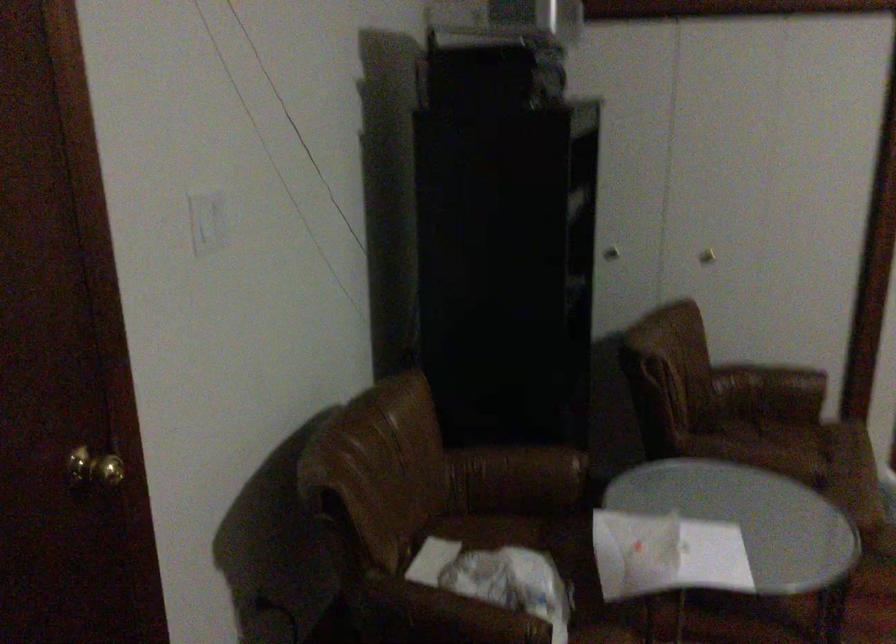
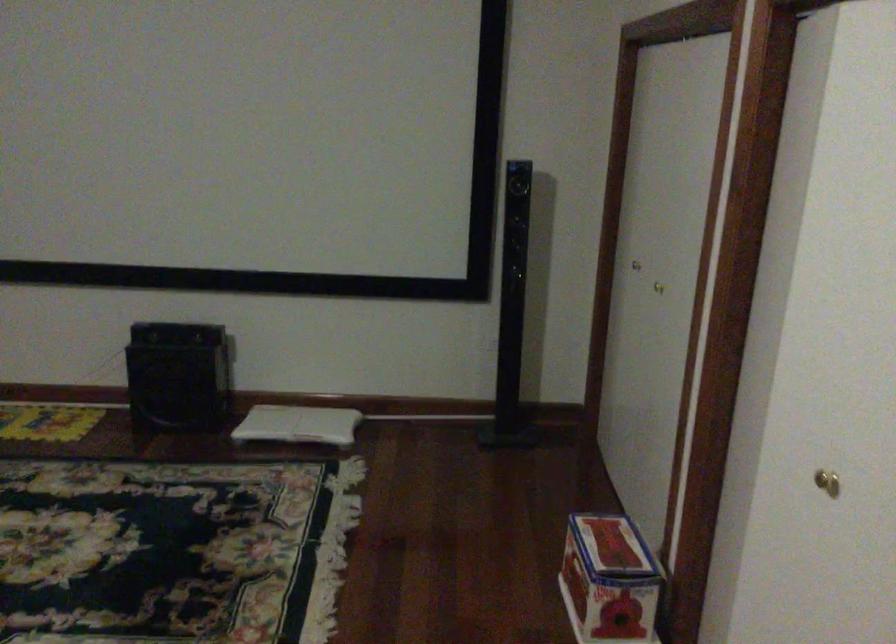
First-person continuous shooting, in which direction is the camera rotating?

The rotation direction of the camera is right-down.